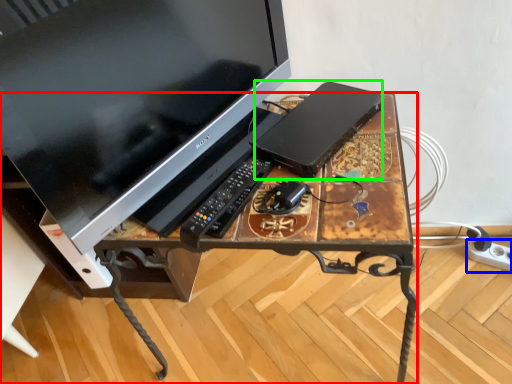
Question: Which object is the farthest from desk (highlighted by a red box)? Choose among these: extension cord (highlighted by a blue box) or computer (highlighted by a green box).

Choices:
 (A) extension cord
 (B) computer

Answer: (A)